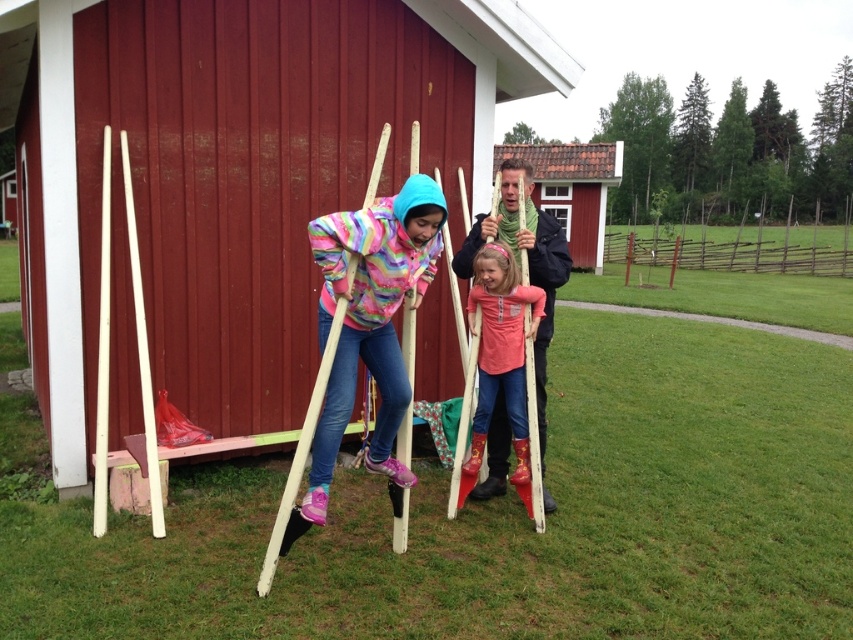
From the picture: You are standing in front of the red wooden structure and want to take a photo of both point (131, 115) and point (399, 268). Which point will appear closer to the bottom of the photo?

Point (399, 268) will appear closer to the bottom of the photo because it is further away from the camera compared to point (131, 115), which is closer to the camera.

In the scene with the red wooden shed, there are two people wearing jackets. One is wearing a rainbow fleece jacket at center and the other a matte pink sweater at center. Which one is positioned more to the left?

The rainbow fleece jacket at center is positioned to the left of the matte pink sweater at center.

You are a photographer trying to capture the scene with a camera that has a 10cm lens. The matte pink sweater at center and the brown tiled roof at upper center are both in your viewfinder. Given their sizes in the image, which object will appear smaller in the final photo?

The matte pink sweater at center will appear smaller in the final photo because it has a smaller size compared to the brown tiled roof at upper center.